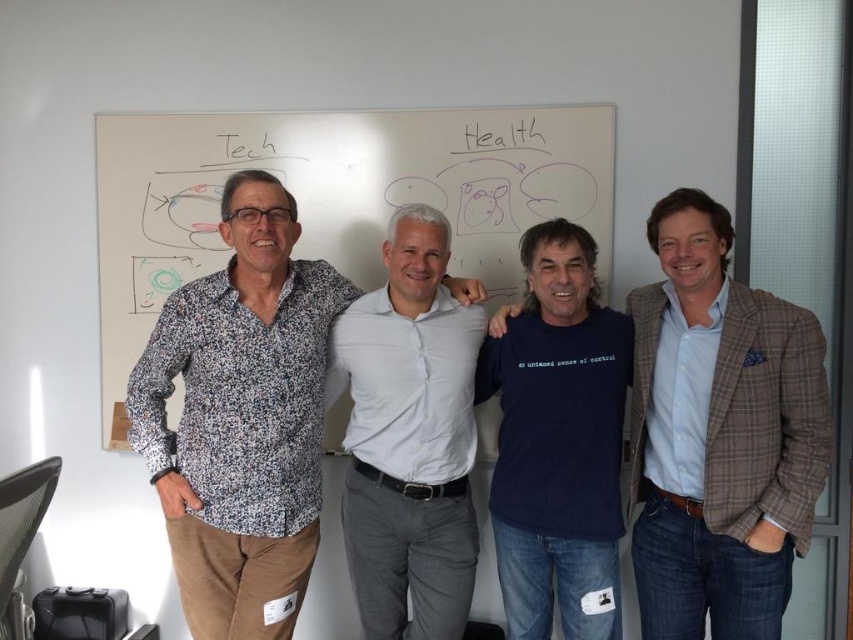
Consider the image. You are standing in the room and looking at the whiteboard. There are two points marked on the whiteboard at coordinates point (660, 346) and point (276, 540). Which point is closer to you?

Point (660, 346) is further to the camera than point (276, 540), so the point closer to you is point (276, 540).